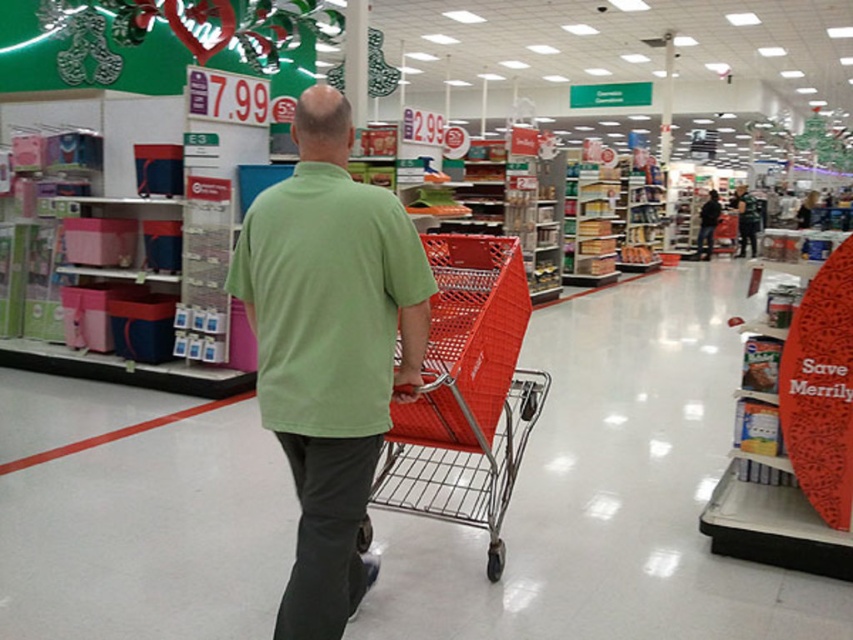
You are a customer in the supermarket and you want to know if the green matte shirt at center can fit inside the metallic red shopping cart at center based on their sizes. Can it fit?

The green matte shirt at center has a smaller size compared to metallic red shopping cart at center, so yes, the green matte shirt at center can fit inside the metallic red shopping cart at center.

Consider the image. You are a customer in the supermarket and want to know if the green matte shirt at center can fit into the metallic red shopping cart at center. Can it?

The green matte shirt at center is thinner than the metallic red shopping cart at center, so it can fit inside the metallic red shopping cart at center.